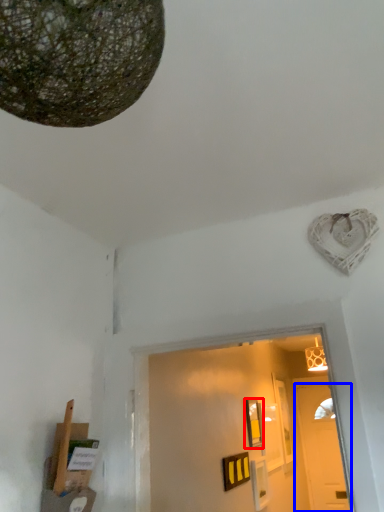
Question: Which object appears farthest to the camera in this image, picture frame (highlighted by a red box) or door (highlighted by a blue box)?

Choices:
 (A) picture frame
 (B) door

Answer: (B)